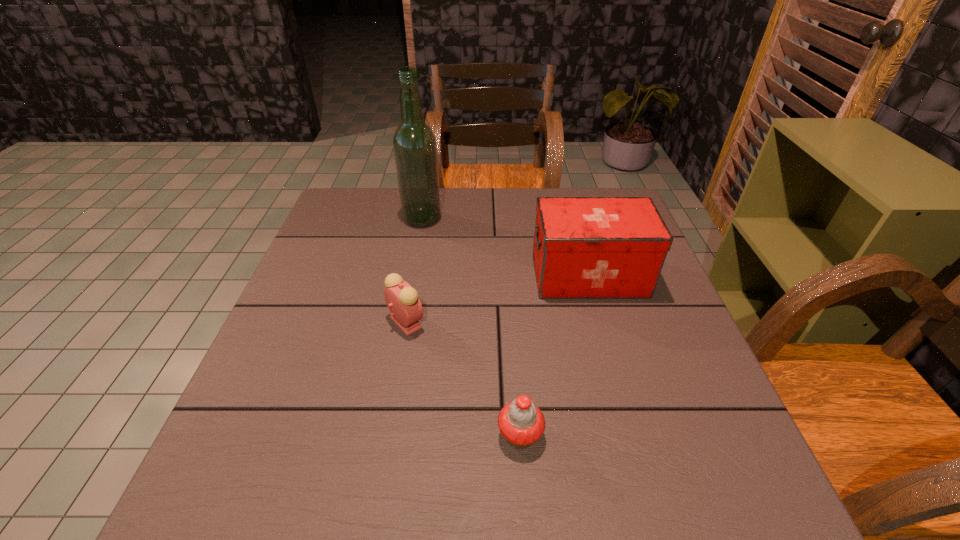
Locate an element on the screen. Image resolution: width=960 pixels, height=540 pixels. the farthest object is located at coordinates (414, 143).

Where is `the tallest object`? the tallest object is located at coordinates (414, 143).

The height and width of the screenshot is (540, 960). What are the coordinates of `the third nearest object` in the screenshot? It's located at (584, 247).

Where is `the rightmost object`? The width and height of the screenshot is (960, 540). the rightmost object is located at coordinates (584, 247).

This screenshot has width=960, height=540. What are the coordinates of `the second nearest object` in the screenshot? It's located at (403, 302).

This screenshot has height=540, width=960. I want to click on the nearest object, so click(x=521, y=422).

You are a GUI agent. You are given a task and a screenshot of the screen. Output one action in this format:
    pyautogui.click(x=<x>, y=<y>)
    Task: Click on the second object from right to left
    This screenshot has height=540, width=960.
    Given the screenshot: What is the action you would take?
    pos(521,422)

You are a GUI agent. You are given a task and a screenshot of the screen. Output one action in this format:
    pyautogui.click(x=<x>, y=<y>)
    Task: Click on the free space located on the front of the liquor
    This screenshot has width=960, height=540.
    Given the screenshot: What is the action you would take?
    pyautogui.click(x=417, y=251)

Identify the location of free space located on the handle side of the third nearest object. This screenshot has height=540, width=960. (489, 276).

You are a GUI agent. You are given a task and a screenshot of the screen. Output one action in this format:
    pyautogui.click(x=<x>, y=<y>)
    Task: Click on the free region located 0.270m on the handle side of the third nearest object
    
    Given the screenshot: What is the action you would take?
    pyautogui.click(x=424, y=276)